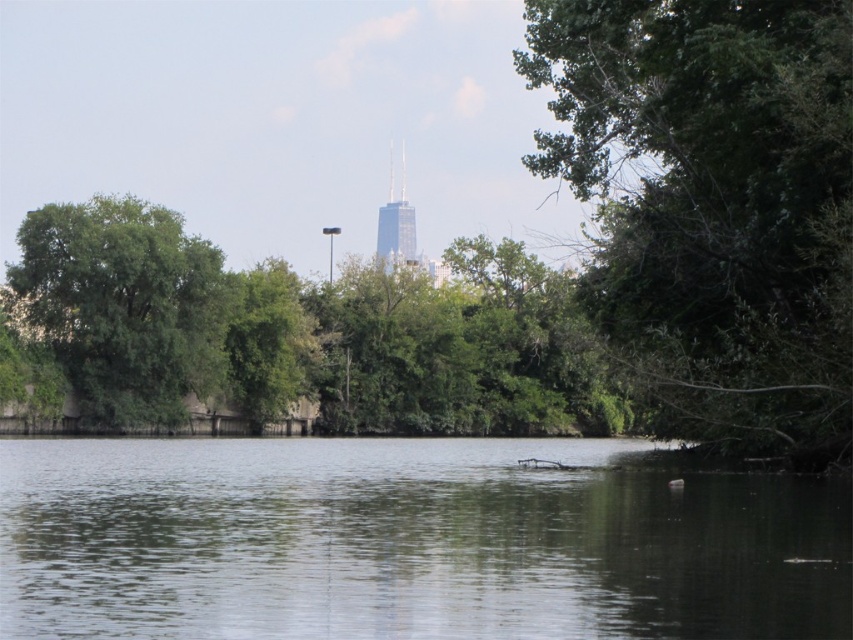
You are standing at the edge of the green reflective water at center and want to walk to the green leafy tree at left. Which direction should you face to walk directly towards it?

You should face towards the left direction to walk directly towards the green leafy tree at left from the green reflective water at center.

You are standing on the embankment between the green reflective water at center and the green leafy tree at right. Which direction should you walk to reach the tree first?

You should walk to the right because the green leafy tree at right is located to the right of the green reflective water at center.

You are standing at the edge of the water in the serene natural scene. There are two points marked in the image. Which point, point (547, 589) or point (190, 282), is closer to you?

Point (547, 589) is closer to the viewer than point (190, 282).